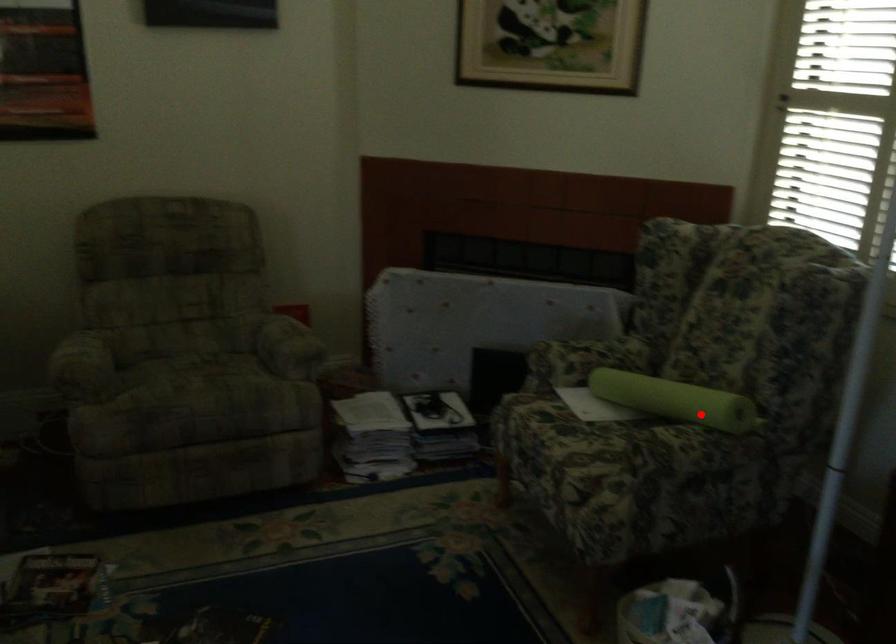
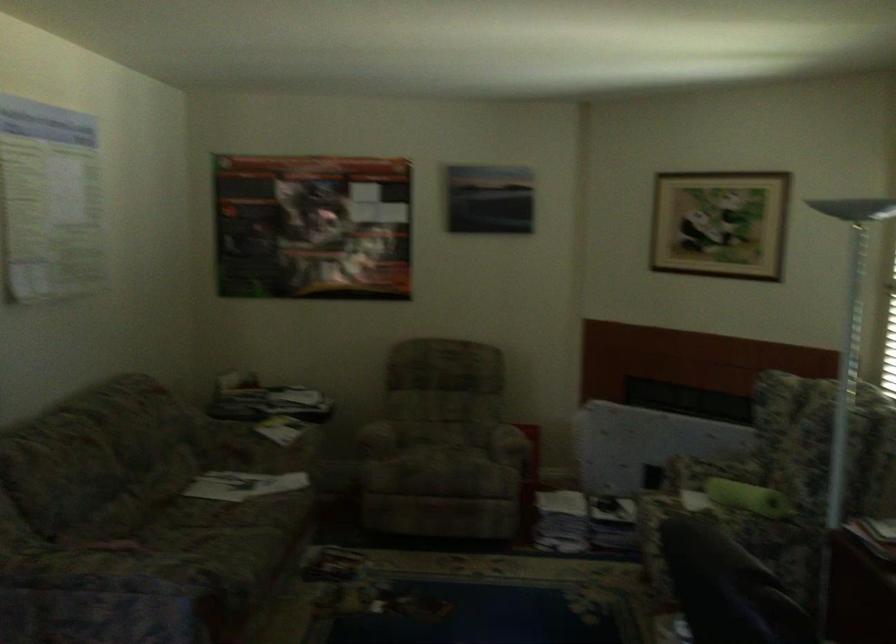
Question: I am providing you with two images of the same scene from different viewpoints. A red point is marked on the first image. At the location where the point appears in image 1, is it still visible in image 2?

Choices:
 (A) Yes
 (B) No

Answer: (A)